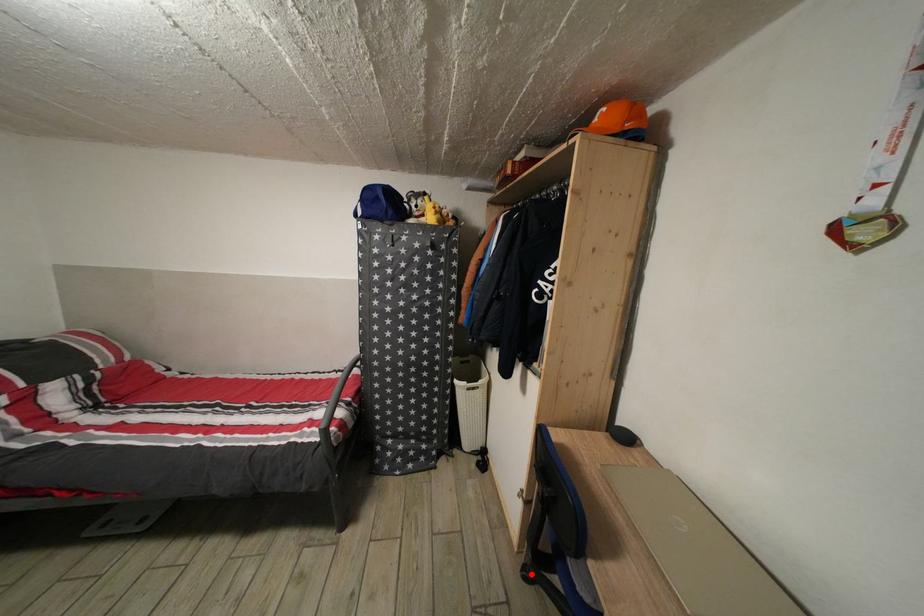
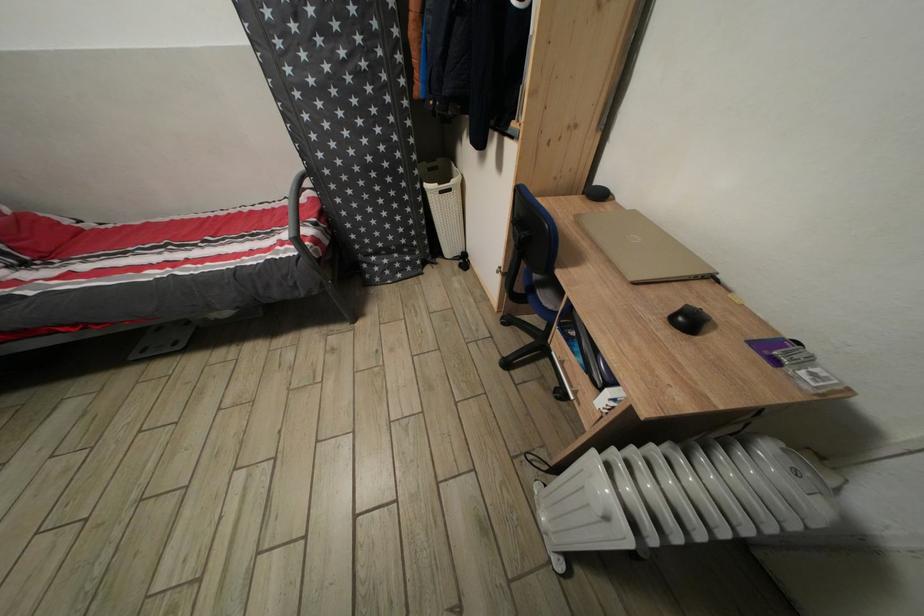
In the second image, find the point that corresponds to the highlighted location in the first image.

(509, 325)